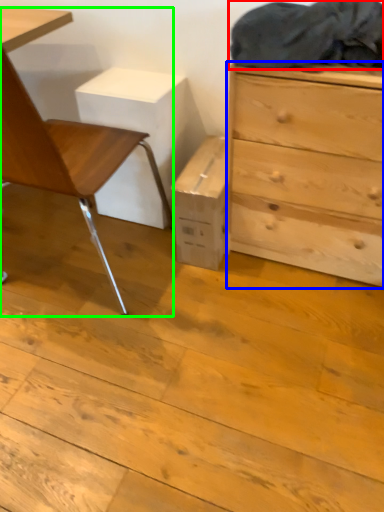
Question: Estimate the real-world distances between objects in this image. Which object is closer to laundry (highlighted by a red box), chest of drawers (highlighted by a blue box) or chair (highlighted by a green box)?

Choices:
 (A) chest of drawers
 (B) chair

Answer: (A)